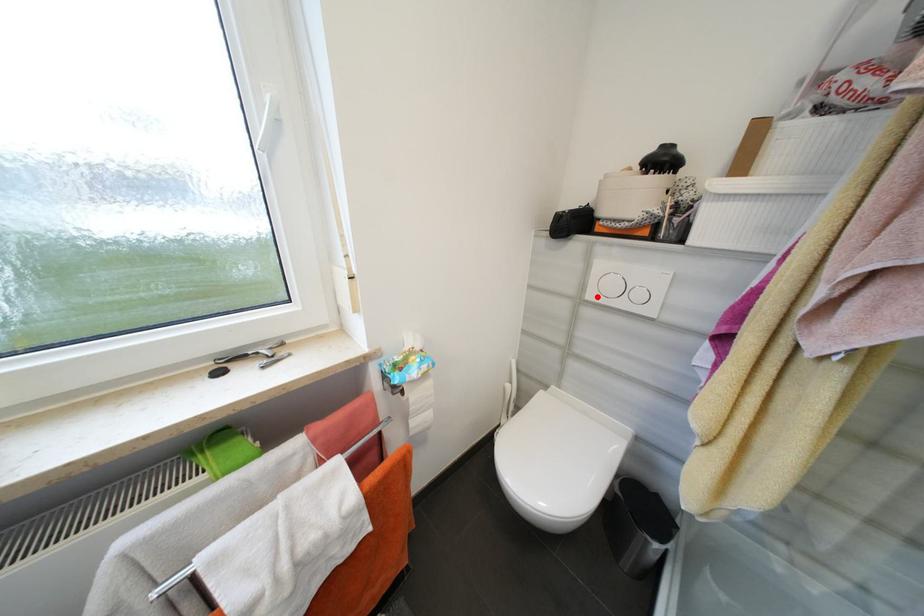
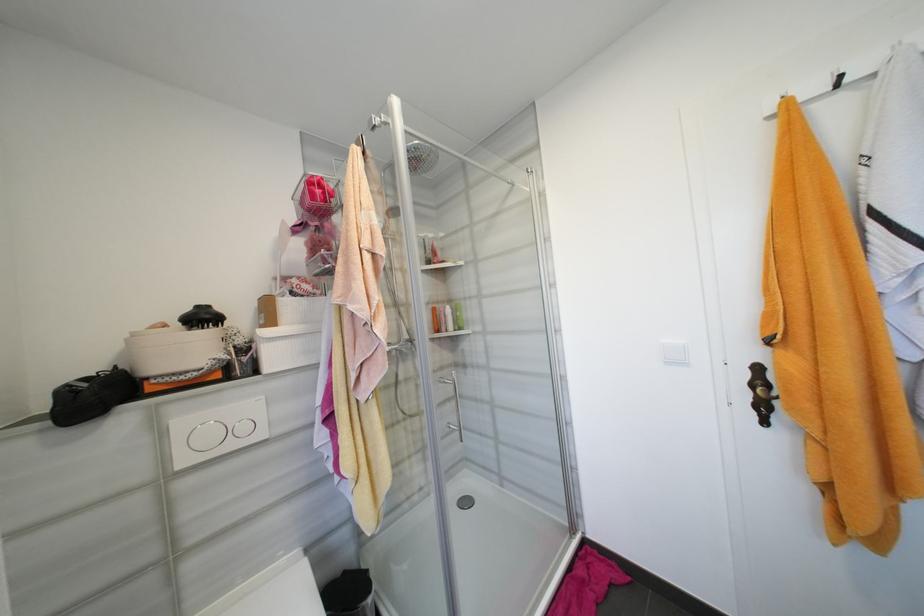
Where in the second image is the point corresponding to the highlighted location from the first image?

(189, 463)